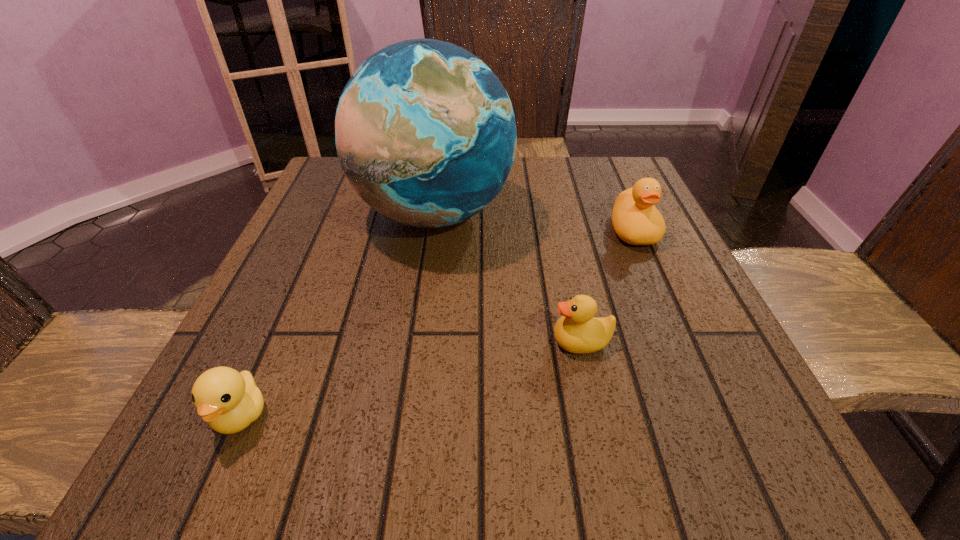
At what (x,y) coordinates should I click in order to perform the action: click on globe. Please return your answer as a coordinate pair (x, y). This screenshot has width=960, height=540. Looking at the image, I should click on (425, 132).

Locate an element on the screen. the tallest object is located at coordinates (425, 132).

This screenshot has width=960, height=540. I want to click on the rightmost object, so click(x=636, y=220).

The width and height of the screenshot is (960, 540). In order to click on the third shortest object in this screenshot , I will do `click(636, 220)`.

Locate an element on the screen. the second duck from right to left is located at coordinates (577, 331).

Where is `the second object from right to left`? the second object from right to left is located at coordinates (577, 331).

What are the coordinates of `the nearest object` in the screenshot? It's located at (229, 401).

In order to click on the leftmost object in this screenshot , I will do `click(229, 401)`.

Image resolution: width=960 pixels, height=540 pixels. What are the coordinates of `vacant space located on the left of the third object from right to left` in the screenshot? It's located at (324, 213).

Identify the location of free space located 0.400m on the face of the second tallest object. The height and width of the screenshot is (540, 960). (726, 444).